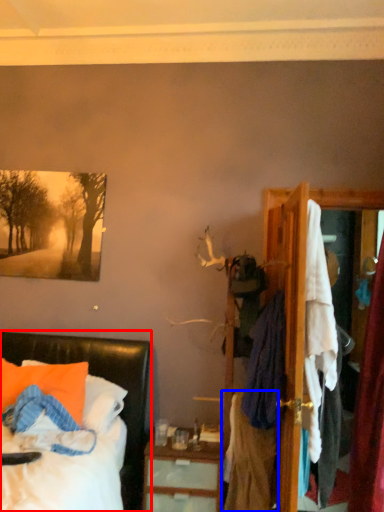
Question: Among these objects, which one is nearest to the camera, bed (highlighted by a red box) or clothing (highlighted by a blue box)?

Choices:
 (A) bed
 (B) clothing

Answer: (A)